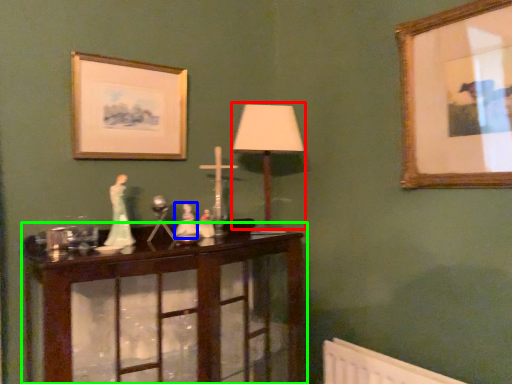
Question: Which object is positioned closest to table lamp (highlighted by a red box)? Select from toy (highlighted by a blue box) and table (highlighted by a green box).

Choices:
 (A) toy
 (B) table

Answer: (A)